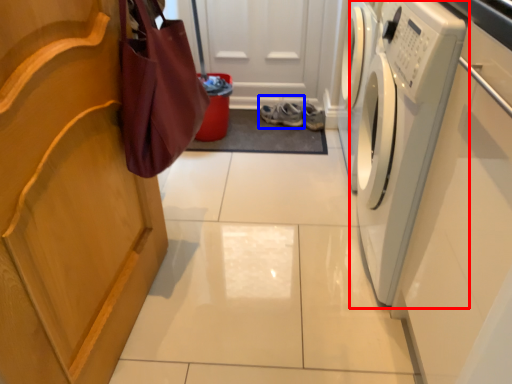
Question: Which of the following is the closest to the observer, washing machine (highlighted by a red box) or footwear (highlighted by a blue box)?

Choices:
 (A) washing machine
 (B) footwear

Answer: (A)